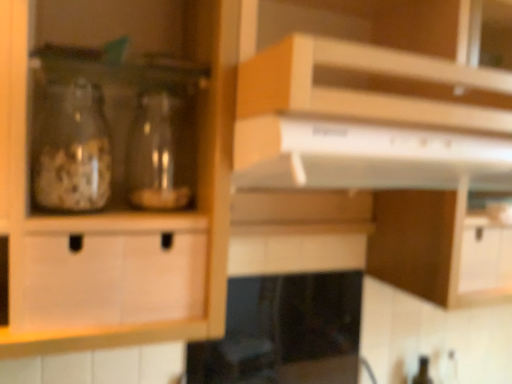
Question: Is black glass stove at lower center facing towards white glossy exhaust hood at upper center?

Choices:
 (A) yes
 (B) no

Answer: (B)

Question: Considering the relative positions of black glass stove at lower center and white glossy exhaust hood at upper center in the image provided, is black glass stove at lower center to the left of white glossy exhaust hood at upper center from the viewer's perspective?

Choices:
 (A) no
 (B) yes

Answer: (B)

Question: Can you confirm if black glass stove at lower center is bigger than white glossy exhaust hood at upper center?

Choices:
 (A) yes
 (B) no

Answer: (A)

Question: Considering the relative positions of black glass stove at lower center and white glossy exhaust hood at upper center in the image provided, is black glass stove at lower center to the right of white glossy exhaust hood at upper center from the viewer's perspective?

Choices:
 (A) yes
 (B) no

Answer: (B)

Question: Is black glass stove at lower center beside white glossy exhaust hood at upper center?

Choices:
 (A) yes
 (B) no

Answer: (B)

Question: Is white glossy exhaust hood at upper center to the left or to the right of black glass stove at lower center in the image?

Choices:
 (A) left
 (B) right

Answer: (B)

Question: Which is correct: white glossy exhaust hood at upper center is inside black glass stove at lower center, or outside of it?

Choices:
 (A) outside
 (B) inside

Answer: (A)

Question: Is white glossy exhaust hood at upper center wider or thinner than black glass stove at lower center?

Choices:
 (A) wide
 (B) thin

Answer: (B)

Question: From a real-world perspective, is white glossy exhaust hood at upper center positioned above or below black glass stove at lower center?

Choices:
 (A) above
 (B) below

Answer: (A)

Question: Looking at their shapes, would you say transparent glass jar at center, arranged as the 1th glass bottle when viewed from the right, is wider or thinner than white glossy exhaust hood at upper center?

Choices:
 (A) thin
 (B) wide

Answer: (A)

Question: Is transparent glass jar at center, marked as the second glass bottle in a left-to-right arrangement, taller or shorter than white glossy exhaust hood at upper center?

Choices:
 (A) short
 (B) tall

Answer: (B)

Question: Is point (132, 193) closer or farther from the camera than point (267, 160)?

Choices:
 (A) closer
 (B) farther

Answer: (B)

Question: Would you say transparent glass jar at center, marked as the second glass bottle in a left-to-right arrangement, is inside or outside white glossy exhaust hood at upper center?

Choices:
 (A) inside
 (B) outside

Answer: (B)

Question: From a real-world perspective, relative to black glass stove at lower center, is transparent glass jar at left, the 2th glass bottle when ordered from right to left, vertically above or below?

Choices:
 (A) above
 (B) below

Answer: (A)

Question: Looking at their shapes, would you say transparent glass jar at left, the 2th glass bottle when ordered from right to left, is wider or thinner than black glass stove at lower center?

Choices:
 (A) wide
 (B) thin

Answer: (B)